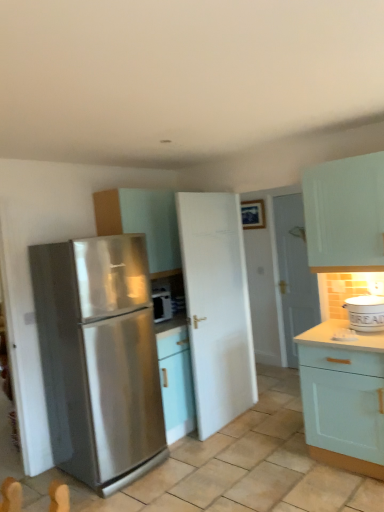
Image resolution: width=384 pixels, height=512 pixels. Find the location of `spots to the right of white matte door at center, which is counted as the 1th door, starting from the left`. spots to the right of white matte door at center, which is counted as the 1th door, starting from the left is located at coordinates (263, 423).